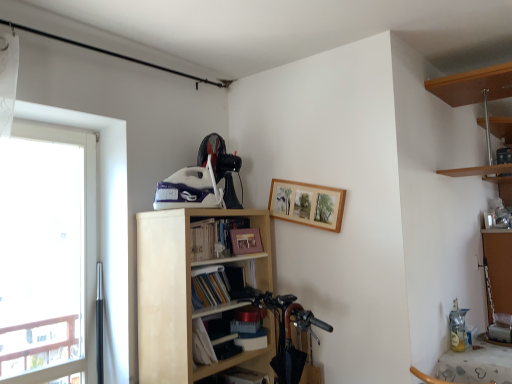
The width and height of the screenshot is (512, 384). I want to click on wooden picture frame at upper center, the 1th picture frame when ordered from left to right, so click(x=246, y=241).

The width and height of the screenshot is (512, 384). What are the coordinates of `transparent glass window at left` in the screenshot? It's located at (104, 223).

Measure the distance between point (263, 305) and camera.

The distance of point (263, 305) from camera is 2.47 meters.

You are a GUI agent. You are given a task and a screenshot of the screen. Output one action in this format:
    pyautogui.click(x=<x>, y=<y>)
    Task: Click on the shiny black mountain bike at lower center
    Image resolution: width=512 pixels, height=384 pixels.
    Given the screenshot: What is the action you would take?
    pyautogui.click(x=285, y=330)

Where is `wooden picture frame at upper center, which is counted as the 2th picture frame, starting from the left`? wooden picture frame at upper center, which is counted as the 2th picture frame, starting from the left is located at coordinates (307, 204).

The image size is (512, 384). I want to click on wooden picture frame at upper center, acting as the second picture frame starting from the top, so click(x=246, y=241).

Is transparent glass window at left facing towards shiny black mountain bike at lower center?

No, transparent glass window at left is not facing towards shiny black mountain bike at lower center.

Considering the relative positions of transparent glass window at left and shiny black mountain bike at lower center in the image provided, is transparent glass window at left in front of shiny black mountain bike at lower center?

That is True.

Does transparent glass window at left have a greater height compared to shiny black mountain bike at lower center?

Indeed, transparent glass window at left has a greater height compared to shiny black mountain bike at lower center.

Is transparent glass window at left far away from shiny black mountain bike at lower center?

That's not correct — transparent glass window at left is a little close to shiny black mountain bike at lower center.

Is matte paper book at center, the 2th book positioned from the top, at the back of wooden picture frame at upper center, acting as the second picture frame starting from the top?

No, wooden picture frame at upper center, acting as the second picture frame starting from the top, is not facing away from matte paper book at center, the 2th book positioned from the top.

Is wooden picture frame at upper center, acting as the second picture frame starting from the top, shorter than matte paper book at center, marked as the first book in a bottom-to-top arrangement?

Yes, wooden picture frame at upper center, acting as the second picture frame starting from the top, is shorter than matte paper book at center, marked as the first book in a bottom-to-top arrangement.

Can you confirm if wooden picture frame at upper center, which appears as the 2th picture frame when viewed from the right, is bigger than matte paper book at center, marked as the first book in a bottom-to-top arrangement?

Incorrect, wooden picture frame at upper center, which appears as the 2th picture frame when viewed from the right, is not larger than matte paper book at center, marked as the first book in a bottom-to-top arrangement.

Considering the positions of objects wooden picture frame at upper center, which is counted as the first picture frame, starting from the bottom, and matte paper book at center, the 2th book positioned from the top, in the image provided, who is more to the right, wooden picture frame at upper center, which is counted as the first picture frame, starting from the bottom, or matte paper book at center, the 2th book positioned from the top,?

From the viewer's perspective, wooden picture frame at upper center, which is counted as the first picture frame, starting from the bottom, appears more on the right side.

From the image's perspective, who appears lower, wooden picture frame at upper center, the 1th picture frame when ordered from left to right, or light wood bookshelf at center?

From the image's view, light wood bookshelf at center is below.

Which point is more forward, (251, 246) or (172, 266)?

The point (172, 266) is in front.

Based on the photo, from a real-world perspective, is wooden picture frame at upper center, acting as the second picture frame starting from the top, located beneath light wood bookshelf at center?

No, from a real-world perspective, wooden picture frame at upper center, acting as the second picture frame starting from the top, is not beneath light wood bookshelf at center.

Is wooden picture frame at upper center, acting as the second picture frame starting from the top, with light wood bookshelf at center?

They are not placed beside each other.

Is shiny black mountain bike at lower center directly adjacent to wooden picture frame at upper center, which appears as the 2th picture frame when viewed from the right?

shiny black mountain bike at lower center and wooden picture frame at upper center, which appears as the 2th picture frame when viewed from the right, are not in contact.

Is shiny black mountain bike at lower center in front of or behind wooden picture frame at upper center, which appears as the 2th picture frame when viewed from the right, in the image?

shiny black mountain bike at lower center is in front of wooden picture frame at upper center, which appears as the 2th picture frame when viewed from the right.

From the image's perspective, is shiny black mountain bike at lower center located above or below wooden picture frame at upper center, which appears as the 2th picture frame when viewed from the right?

Clearly, from the image's perspective, shiny black mountain bike at lower center is below wooden picture frame at upper center, which appears as the 2th picture frame when viewed from the right.

This screenshot has width=512, height=384. I want to click on mountain bike on the right side of wooden picture frame at upper center, which appears as the 2th picture frame when viewed from the right, so click(285, 330).

From a real-world perspective, between hardcover book at center, the 2th book ordered from the bottom, and shiny black mountain bike at lower center, who is vertically higher?

hardcover book at center, the 2th book ordered from the bottom, from a real-world perspective.

Find the location of a particular element. mountain bike below the hardcover book at center, the 2th book ordered from the bottom (from the image's perspective) is located at coordinates (285, 330).

What's the angular difference between hardcover book at center, which appears as the 1th book when viewed from the top, and shiny black mountain bike at lower center's facing directions?

89.2 degrees separate the facing orientations of hardcover book at center, which appears as the 1th book when viewed from the top, and shiny black mountain bike at lower center.

Is hardcover book at center, the 2th book ordered from the bottom, to the right of shiny black mountain bike at lower center from the viewer's perspective?

In fact, hardcover book at center, the 2th book ordered from the bottom, is to the left of shiny black mountain bike at lower center.

Would you say matte paper book at center, marked as the first book in a bottom-to-top arrangement, is outside wooden picture frame at upper center, the second picture frame positioned from the bottom?

matte paper book at center, marked as the first book in a bottom-to-top arrangement, lies outside wooden picture frame at upper center, the second picture frame positioned from the bottom,'s area.

Looking at this image, between matte paper book at center, the 2th book positioned from the top, and wooden picture frame at upper center, which appears as the 1th picture frame when viewed from the top, which one is positioned behind?

wooden picture frame at upper center, which appears as the 1th picture frame when viewed from the top, is more distant.

From a real-world perspective, which object stands above the other?

wooden picture frame at upper center, which is counted as the 2th picture frame, starting from the left, is physically above.

Would you say matte paper book at center, marked as the first book in a bottom-to-top arrangement, is to the left or to the right of wooden picture frame at upper center, placed as the 1th picture frame when sorted from right to left, in the picture?

Clearly, matte paper book at center, marked as the first book in a bottom-to-top arrangement, is on the left of wooden picture frame at upper center, placed as the 1th picture frame when sorted from right to left, in the image.

Between shiny black mountain bike at lower center and hardcover book at center, which appears as the 1th book when viewed from the top, which one has larger width?

Wider between the two is hardcover book at center, which appears as the 1th book when viewed from the top.

From the image's perspective, is shiny black mountain bike at lower center under hardcover book at center, the 2th book ordered from the bottom?

Correct, shiny black mountain bike at lower center appears lower than hardcover book at center, the 2th book ordered from the bottom, in the image.

In the scene shown: Is shiny black mountain bike at lower center positioned with its back to hardcover book at center, which appears as the 1th book when viewed from the top?

shiny black mountain bike at lower center is not turned away from hardcover book at center, which appears as the 1th book when viewed from the top.

Considering the positions of objects shiny black mountain bike at lower center and hardcover book at center, which appears as the 1th book when viewed from the top, in the image provided, who is behind, shiny black mountain bike at lower center or hardcover book at center, which appears as the 1th book when viewed from the top,?

shiny black mountain bike at lower center is more distant.

At what (x,y) coordinates should I click in order to perform the action: click on window that is above the shiny black mountain bike at lower center (from a real-world perspective). Please return your answer as a coordinate pair (x, y). The width and height of the screenshot is (512, 384). Looking at the image, I should click on (104, 223).

This screenshot has width=512, height=384. In order to click on the 2nd book in front of the wooden picture frame at upper center, which appears as the 2th picture frame when viewed from the right in this screenshot , I will do `click(220, 283)`.

Estimate the real-world distances between objects in this image. Which object is further from hardcover book at center, the 2th book ordered from the bottom, shiny black mountain bike at lower center or light wood bookshelf at center?

shiny black mountain bike at lower center is positioned further to the anchor hardcover book at center, the 2th book ordered from the bottom.

Based on their spatial positions, is matte paper book at center, marked as the first book in a bottom-to-top arrangement, or wooden picture frame at upper center, which appears as the 1th picture frame when viewed from the top, closer to hardcover book at center, which appears as the 1th book when viewed from the top?

Based on the image, matte paper book at center, marked as the first book in a bottom-to-top arrangement, appears to be nearer to hardcover book at center, which appears as the 1th book when viewed from the top.

Which object lies further to the anchor point matte paper book at center, marked as the first book in a bottom-to-top arrangement, wooden picture frame at upper center, which appears as the 2th picture frame when viewed from the right, or hardcover book at center, which appears as the 1th book when viewed from the top?

wooden picture frame at upper center, which appears as the 2th picture frame when viewed from the right.

Which object lies nearer to the anchor point shiny black mountain bike at lower center, wooden picture frame at upper center, acting as the second picture frame starting from the top, or light wood bookshelf at center?

Based on the image, light wood bookshelf at center appears to be nearer to shiny black mountain bike at lower center.

Considering their positions, is matte paper book at center, the 2th book positioned from the top, positioned further to transparent glass window at left than wooden picture frame at upper center, which is counted as the 2th picture frame, starting from the left?

Among the two, wooden picture frame at upper center, which is counted as the 2th picture frame, starting from the left, is located further to transparent glass window at left.

Considering their positions, is light wood bookshelf at center positioned further to shiny black mountain bike at lower center than matte paper book at center, marked as the first book in a bottom-to-top arrangement?

light wood bookshelf at center is further to shiny black mountain bike at lower center.

Based on the photo, based on their spatial positions, is transparent glass window at left or matte paper book at center, marked as the first book in a bottom-to-top arrangement, further from wooden picture frame at upper center, the 1th picture frame when ordered from left to right?

The object further to wooden picture frame at upper center, the 1th picture frame when ordered from left to right, is transparent glass window at left.

Based on their spatial positions, is wooden picture frame at upper center, the second picture frame positioned from the bottom, or hardcover book at center, the 2th book ordered from the bottom, further from matte paper book at center, marked as the first book in a bottom-to-top arrangement?

Among the two, wooden picture frame at upper center, the second picture frame positioned from the bottom, is located further to matte paper book at center, marked as the first book in a bottom-to-top arrangement.

Where is `book between transparent glass window at left and light wood bookshelf at center from left to right`? The height and width of the screenshot is (384, 512). book between transparent glass window at left and light wood bookshelf at center from left to right is located at coordinates (218, 238).

The image size is (512, 384). I want to click on shelf between transparent glass window at left and wooden picture frame at upper center, placed as the 1th picture frame when sorted from right to left, so click(188, 293).

Locate an element on the screen. picture frame that lies between hardcover book at center, which appears as the 1th book when viewed from the top, and shiny black mountain bike at lower center from top to bottom is located at coordinates (246, 241).

At what (x,y) coordinates should I click in order to perform the action: click on shelf between wooden picture frame at upper center, which is counted as the 2th picture frame, starting from the left, and shiny black mountain bike at lower center, in the vertical direction. Please return your answer as a coordinate pair (x, y). The image size is (512, 384). Looking at the image, I should click on (188, 293).